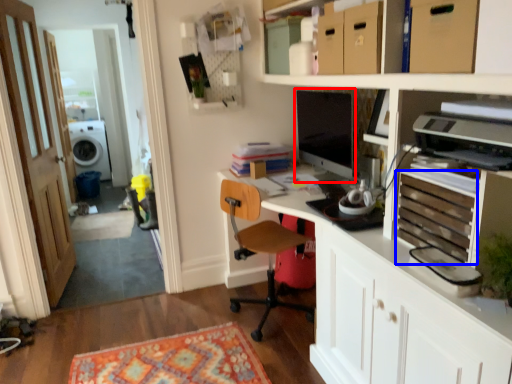
Question: Among these objects, which one is nearest to the camera, computer monitor (highlighted by a red box) or drawer (highlighted by a blue box)?

Choices:
 (A) computer monitor
 (B) drawer

Answer: (B)